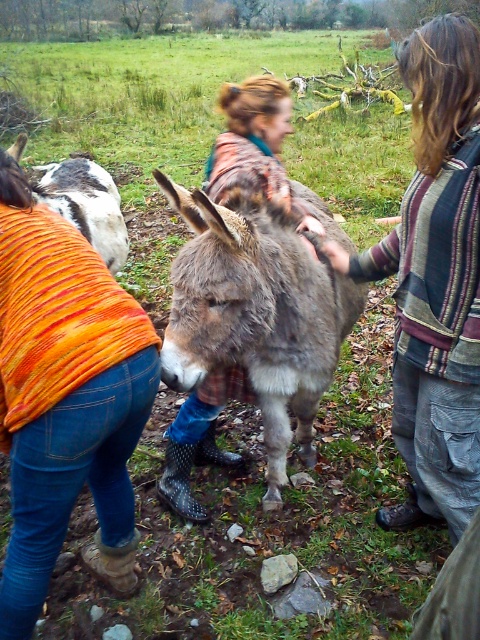
Which is in front, point (223, 323) or point (70, 211)?

Point (223, 323) is in front.

Does point (202, 355) come farther from viewer compared to point (22, 136)?

No.

This screenshot has width=480, height=640. I want to click on fuzzy gray donkey at center, so click(x=255, y=316).

Looking at this image, is orange knitted sweater at lower left closer to camera compared to white fur donkey at left?

Yes, it is.

Who is positioned more to the right, orange knitted sweater at lower left or white fur donkey at left?

orange knitted sweater at lower left

Which is in front, point (57, 369) or point (80, 202)?

Positioned in front is point (57, 369).

Identify the location of orange knitted sweater at lower left. This screenshot has height=640, width=480. (64, 397).

Is striped wool sweater at center shorter than fuzzy gray donkey at center?

No.

Does striped wool sweater at center appear on the left side of fuzzy gray donkey at center?

In fact, striped wool sweater at center is to the right of fuzzy gray donkey at center.

At what (x,y) coordinates should I click in order to perform the action: click on striped wool sweater at center. Please return your answer as a coordinate pair (x, y). The image size is (480, 640). Looking at the image, I should click on (434, 280).